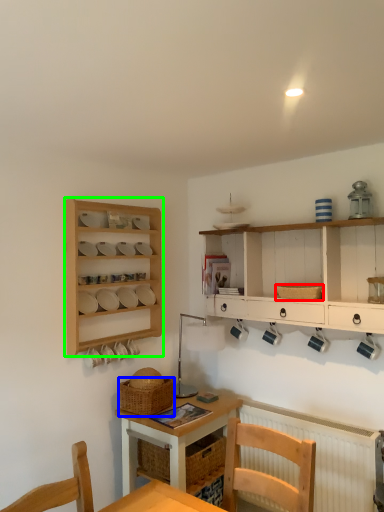
Question: Which is nearer to the basket (highlighted by a red box)? basket (highlighted by a blue box) or shelf (highlighted by a green box).

Choices:
 (A) basket
 (B) shelf

Answer: (A)